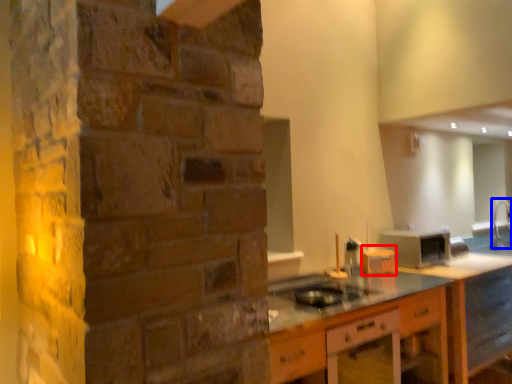
Question: Which of the following is the farthest to the observer, appliance (highlighted by a red box) or faucet (highlighted by a blue box)?

Choices:
 (A) appliance
 (B) faucet

Answer: (B)